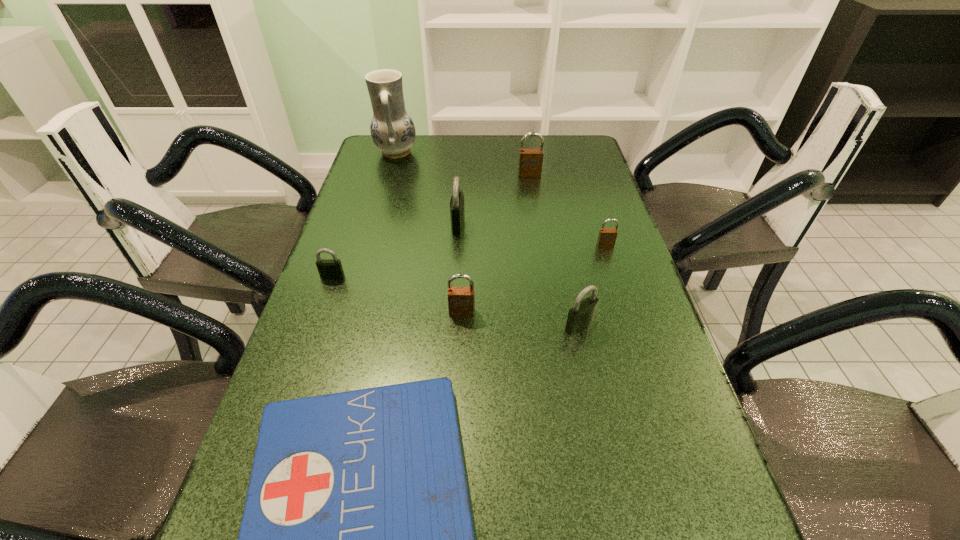
Where is `the fourth farthest object`? Image resolution: width=960 pixels, height=540 pixels. the fourth farthest object is located at coordinates (607, 237).

Locate an element on the screen. This screenshot has height=540, width=960. the rightmost padlock is located at coordinates (607, 237).

Find the location of a particular element. This screenshot has height=540, width=960. the leftmost padlock is located at coordinates (328, 268).

The image size is (960, 540). In order to click on the leftmost black padlock in this screenshot , I will do `click(328, 268)`.

This screenshot has height=540, width=960. I want to click on free location located 0.390m on the right of the farthest object, so click(x=528, y=152).

Locate an element on the screen. This screenshot has height=540, width=960. vacant region located on the right of the biggest black padlock is located at coordinates (490, 225).

Where is `vacant space located 0.400m on the front-facing side of the second brown padlock from right to left`? vacant space located 0.400m on the front-facing side of the second brown padlock from right to left is located at coordinates (542, 259).

This screenshot has height=540, width=960. Identify the location of vacant space located on the back of the rightmost black padlock. (563, 243).

Find the location of a particular element. This screenshot has width=960, height=540. vacant space situated 0.220m on the front-facing side of the nearest brown padlock is located at coordinates (458, 402).

Locate an element on the screen. Image resolution: width=960 pixels, height=540 pixels. free space located 0.070m on the front-facing side of the rightmost padlock is located at coordinates (612, 266).